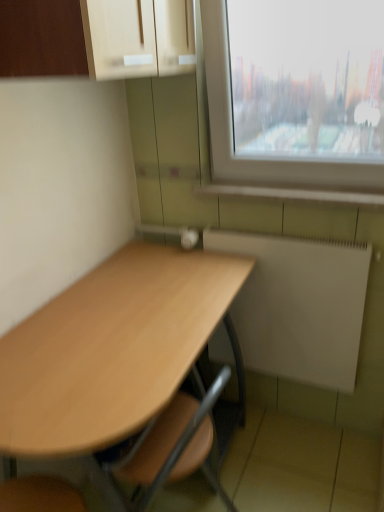
At what (x,y) coordinates should I click in order to perform the action: click on free space above white tile at lower right (from a real-world perspective). Please return your answer as a coordinate pair (x, y). Image resolution: width=384 pixels, height=512 pixels. Looking at the image, I should click on (288, 175).